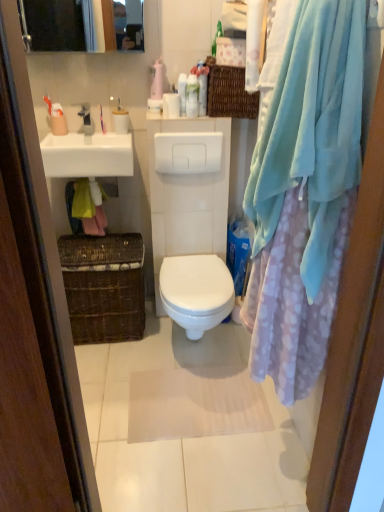
Question: From the image's perspective, is matte plastic toothbrush at upper left, which appears as the sixth toiletry when viewed from the right, positioned above or below white glossy toilet at center?

Choices:
 (A) above
 (B) below

Answer: (A)

Question: Based on their positions, is matte plastic toothbrush at upper left, which is counted as the first toiletry, starting from the left, located to the left or right of white glossy toilet at center?

Choices:
 (A) right
 (B) left

Answer: (B)

Question: Estimate the real-world distances between objects in this image. Which object is closer to the satin silver faucet at upper center?

Choices:
 (A) matte plastic screen door at left
 (B) brown woven laundry basket at lower left
 (C) white glossy sink at upper left
 (D) white glossy bottle at upper center, which is the second toiletry in right-to-left order
 (E) light blue plush bath towel at right

Answer: (C)

Question: Which of these objects is positioned closest to the matte plastic toothbrush at upper left, the second toiletry in the left-to-right sequence?

Choices:
 (A) light blue plush bath towel at right
 (B) white glossy sink at upper left
 (C) white glossy bottle at upper center, the fifth toiletry positioned from the left
 (D) matte white medicine cabinet at upper left
 (E) white textured bath mat at center

Answer: (B)